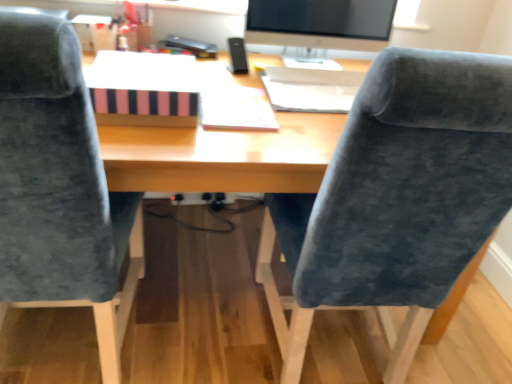
What are the coordinates of `free space to the right of black plastic remote at center` in the screenshot? It's located at (273, 68).